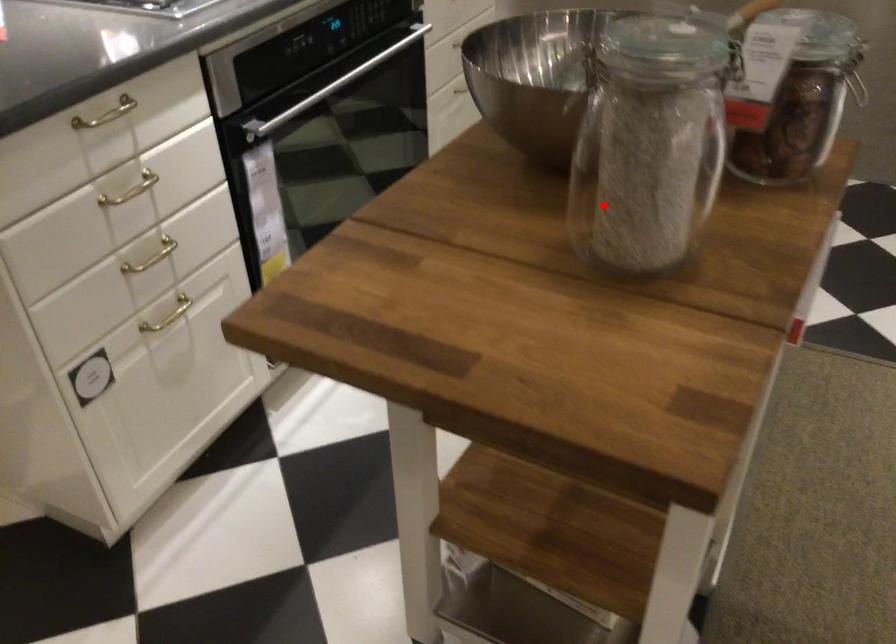
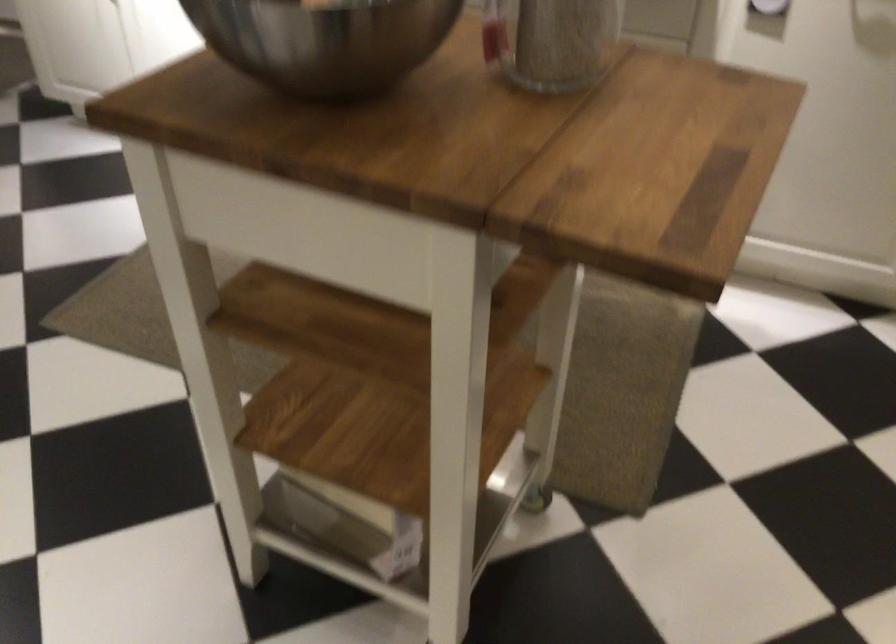
Question: I am providing you with two images of the same scene from different viewpoints. In image1, a red point is highlighted. Considering the same 3D point in image2, which of the following is correct?

Choices:
 (A) It is closer
 (B) It is farther

Answer: (B)